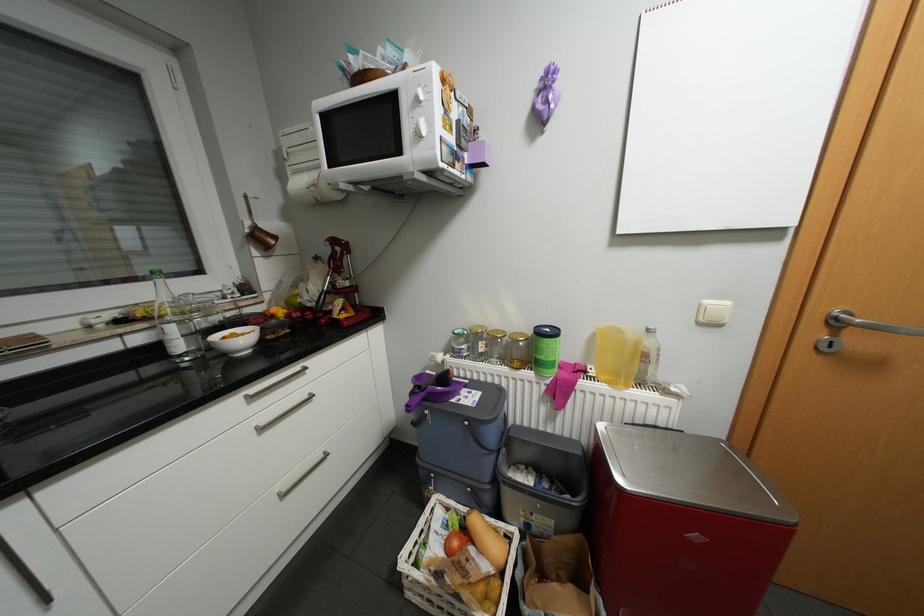
Find where to turn the silver door handle. Please return your answer as a coordinate pair (x, y).

(890, 70)